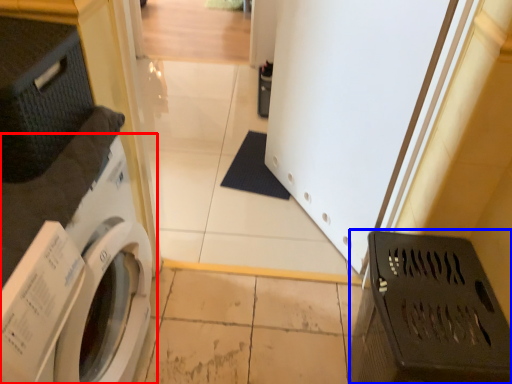
Question: Which object appears closest to the camera in this image, washing machine (highlighted by a red box) or laundry basket (highlighted by a blue box)?

Choices:
 (A) washing machine
 (B) laundry basket

Answer: (A)